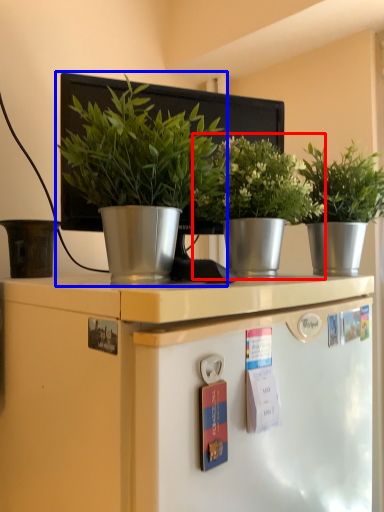
Question: Which point is closer to the camera, houseplant (highlighted by a red box) or houseplant (highlighted by a blue box)?

Choices:
 (A) houseplant
 (B) houseplant

Answer: (B)